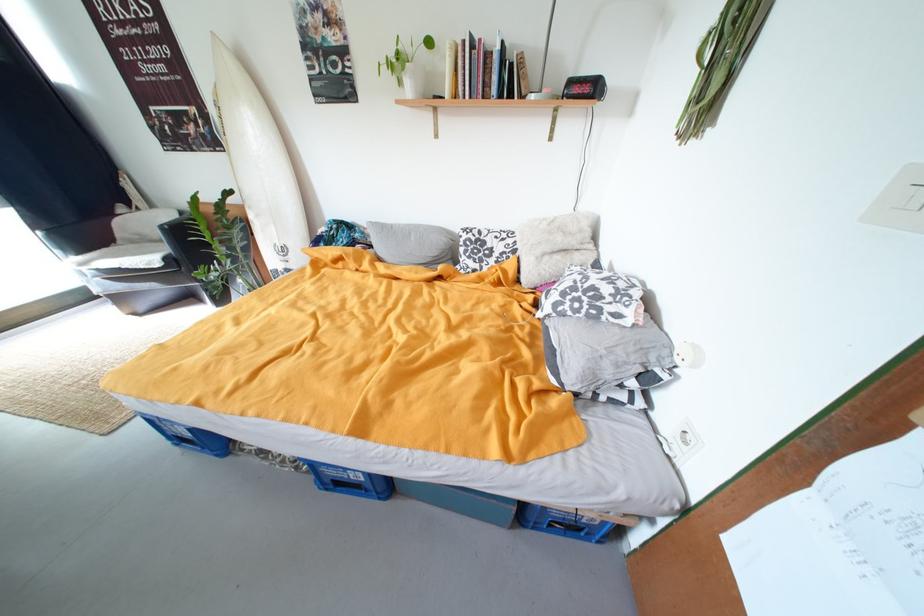
Describe the element at coordinates (177, 233) in the screenshot. The width and height of the screenshot is (924, 616). I see `the chair armrest` at that location.